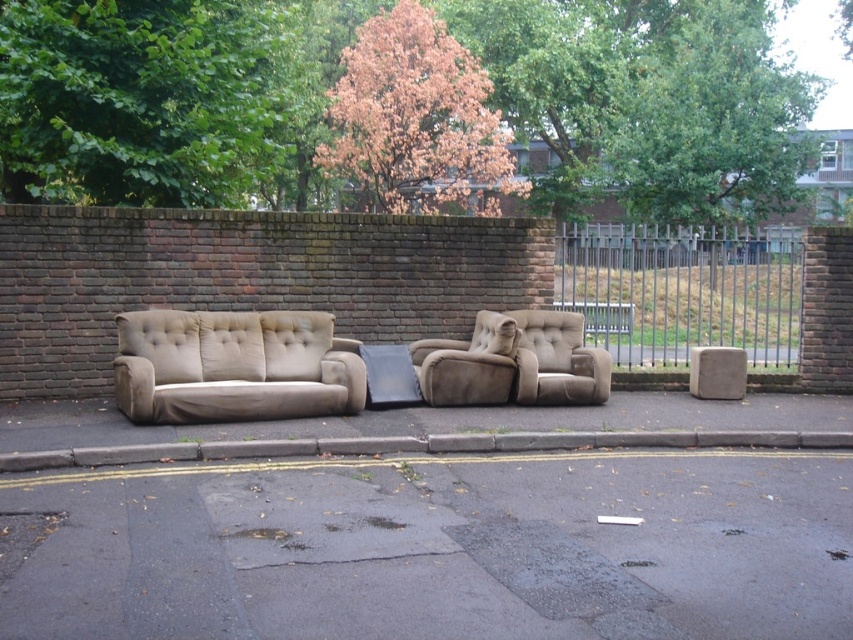
Question: Estimate the real-world distances between objects in this image. Which object is closer to the beige fabric armchair at center?

Choices:
 (A) dark gray asphalt at lower center
 (B) gray concrete curb at lower center

Answer: (B)

Question: Is beige fabric couch at center to the right of gray concrete curb at lower center from the viewer's perspective?

Choices:
 (A) no
 (B) yes

Answer: (A)

Question: Which of the following is the closest to the observer?

Choices:
 (A) metallic silver fence at right
 (B) dark gray asphalt at lower center

Answer: (B)

Question: Can you confirm if metallic silver fence at right is positioned to the right of beige fabric armchair at center?

Choices:
 (A) no
 (B) yes

Answer: (B)

Question: Does beige fabric daybed at center have a smaller size compared to beige fabric couch at center?

Choices:
 (A) yes
 (B) no

Answer: (B)

Question: Which point is farther from the camera taking this photo?

Choices:
 (A) [433, 380]
 (B) [323, 544]
 (C) [643, 337]
 (D) [241, 326]

Answer: (C)